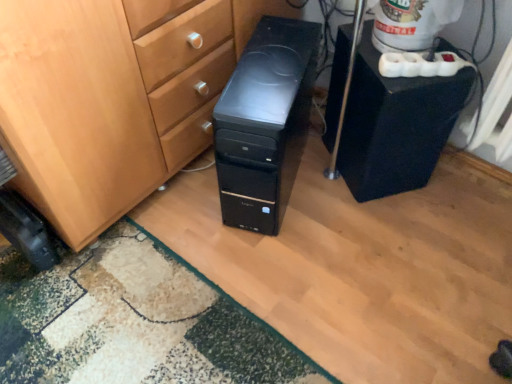
At what (x,y) coordinates should I click in order to perform the action: click on free area in between black plastic speaker at right and green textured rug at lower left. Please return your answer as a coordinate pair (x, y). The height and width of the screenshot is (384, 512). Looking at the image, I should click on (287, 247).